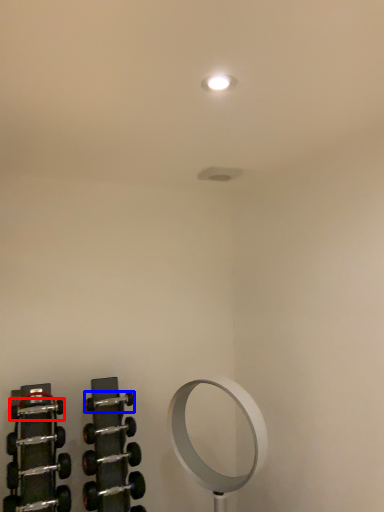
Question: Which object appears farthest to the camera in this image, dumbbell (highlighted by a red box) or dumbbell (highlighted by a blue box)?

Choices:
 (A) dumbbell
 (B) dumbbell

Answer: (B)